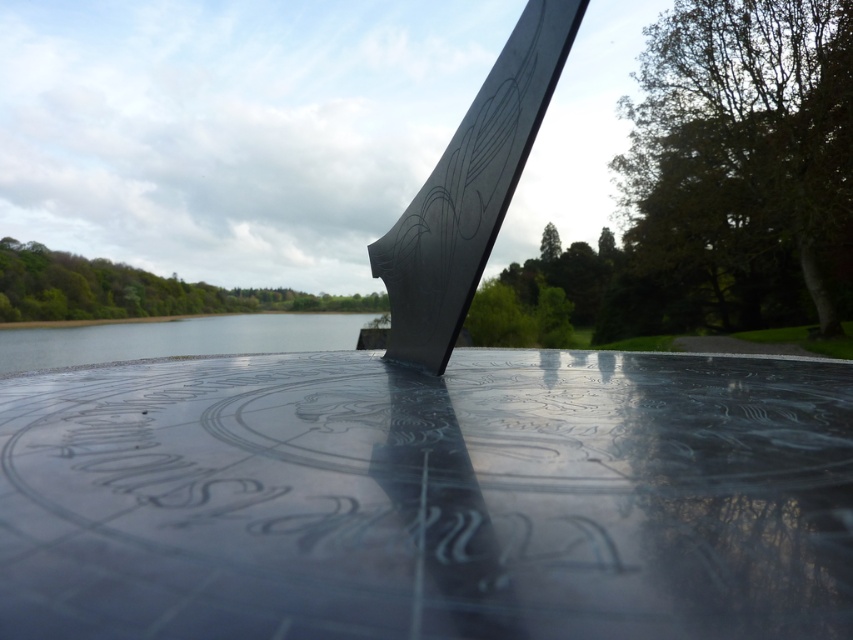
You are a small toy boat that is 1 foot long. You are currently floating on the clear water at lower left and want to reach the black polished metal blade at center. Can you navigate to it without getting stuck?

The distance between the black polished metal blade at center and clear water at lower left is 8.23 feet. Since the boat is 1 foot long, it can easily navigate the 8.23 feet distance to reach the black polished metal blade at center.

You are an artist trying to sketch the sundial and its surroundings. You notice the black polished metal blade at center and the clear water at lower left. Which object has a smaller width in the image?

The black polished metal blade at center has a lesser width compared to the clear water at lower left, so the black polished metal blade at center is narrower.

You are standing near the black polished metal blade at center and clear water at lower left. Which object is closer to your right side?

The black polished metal blade at center is positioned on the right side of clear water at lower left, so it is closer to your right side.